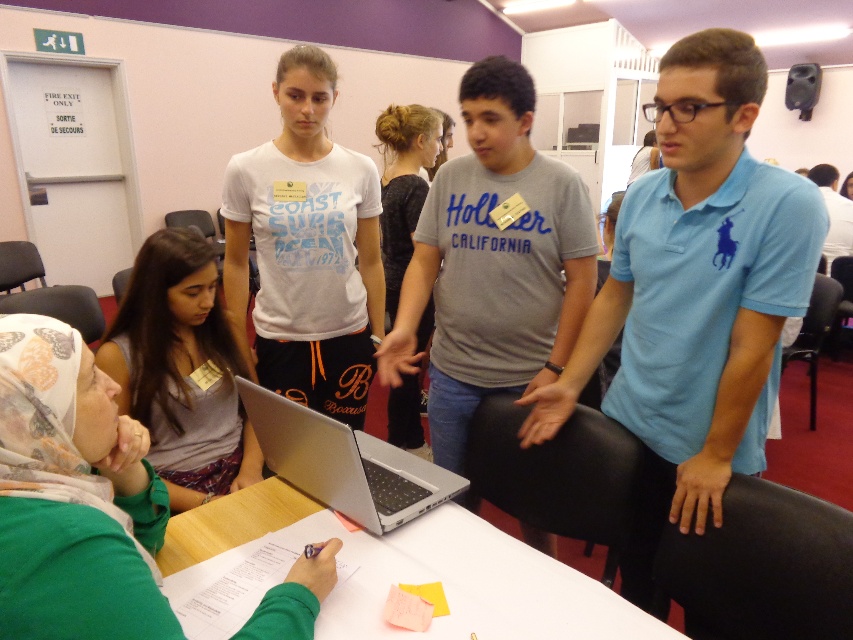
Who is lower down, matte gray laptop at center or white paper at center?

white paper at center

Is matte gray laptop at center positioned at the back of white paper at center?

That is False.

Which is in front, point (149, 620) or point (334, 627)?

Point (149, 620) is more forward.

You are a GUI agent. You are given a task and a screenshot of the screen. Output one action in this format:
    pyautogui.click(x=<x>, y=<y>)
    Task: Click on the matte gray laptop at center
    
    Given the screenshot: What is the action you would take?
    coord(71,497)

Is white paper at center above silver metallic laptop at center?

No.

Does white paper at center lie behind silver metallic laptop at center?

That is False.

Image resolution: width=853 pixels, height=640 pixels. What are the coordinates of `white paper at center` in the screenshot? It's located at (416, 570).

You are a GUI agent. You are given a task and a screenshot of the screen. Output one action in this format:
    pyautogui.click(x=<x>, y=<y>)
    Task: Click on the white paper at center
    The height and width of the screenshot is (640, 853).
    Given the screenshot: What is the action you would take?
    pyautogui.click(x=416, y=570)

Is point (213, 316) positioned before point (381, 131)?

Yes.

Who is more forward, (x=173, y=230) or (x=383, y=124)?

Point (x=173, y=230) is in front.

The height and width of the screenshot is (640, 853). Find the location of `matte gray shirt at center`. matte gray shirt at center is located at coordinates (181, 369).